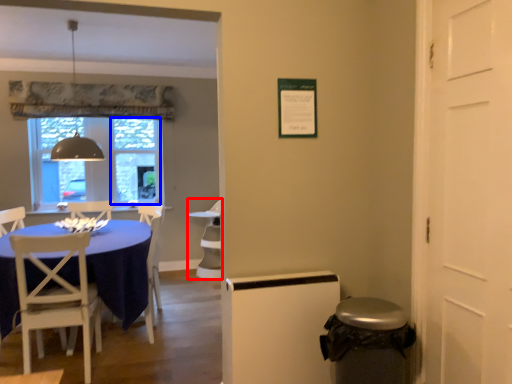
Question: Which object appears closest to the camera in this image, armchair (highlighted by a red box) or glass door (highlighted by a blue box)?

Choices:
 (A) armchair
 (B) glass door

Answer: (A)